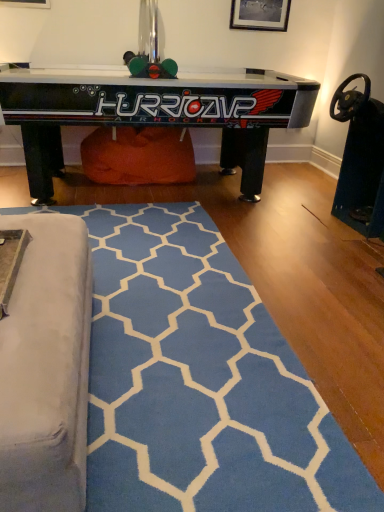
Question: From a real-world perspective, is black glossy air hockey table at upper center physically below blue soft rug at lower center?

Choices:
 (A) no
 (B) yes

Answer: (A)

Question: Considering the relative sizes of black glossy air hockey table at upper center and blue soft rug at lower center in the image provided, is black glossy air hockey table at upper center smaller than blue soft rug at lower center?

Choices:
 (A) yes
 (B) no

Answer: (B)

Question: Is blue soft rug at lower center surrounded by black glossy air hockey table at upper center?

Choices:
 (A) yes
 (B) no

Answer: (B)

Question: Is black glossy air hockey table at upper center far from blue soft rug at lower center?

Choices:
 (A) yes
 (B) no

Answer: (A)

Question: Is black glossy air hockey table at upper center not within blue soft rug at lower center?

Choices:
 (A) no
 (B) yes

Answer: (B)

Question: From the image's perspective, is black glossy air hockey table at upper center on blue soft rug at lower center?

Choices:
 (A) no
 (B) yes

Answer: (B)

Question: From a real-world perspective, is blue soft rug at lower center beneath black glossy air hockey table at upper center?

Choices:
 (A) yes
 (B) no

Answer: (A)

Question: Can you confirm if blue soft rug at lower center is smaller than black glossy air hockey table at upper center?

Choices:
 (A) no
 (B) yes

Answer: (B)

Question: Is blue soft rug at lower center far from black glossy air hockey table at upper center?

Choices:
 (A) no
 (B) yes

Answer: (B)

Question: From the image's perspective, is blue soft rug at lower center on top of black glossy air hockey table at upper center?

Choices:
 (A) no
 (B) yes

Answer: (A)

Question: Is blue soft rug at lower center oriented away from black glossy air hockey table at upper center?

Choices:
 (A) yes
 (B) no

Answer: (B)

Question: Is blue soft rug at lower center further to camera compared to black glossy air hockey table at upper center?

Choices:
 (A) no
 (B) yes

Answer: (A)

Question: From a real-world perspective, does black glossy air hockey table at upper center stand above wooden picture frame at upper center?

Choices:
 (A) no
 (B) yes

Answer: (A)